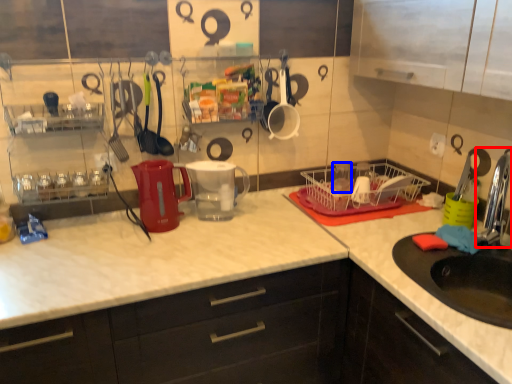
Question: Which of the following is the closest to the observer, faucet (highlighted by a red box) or tableware (highlighted by a blue box)?

Choices:
 (A) faucet
 (B) tableware

Answer: (A)